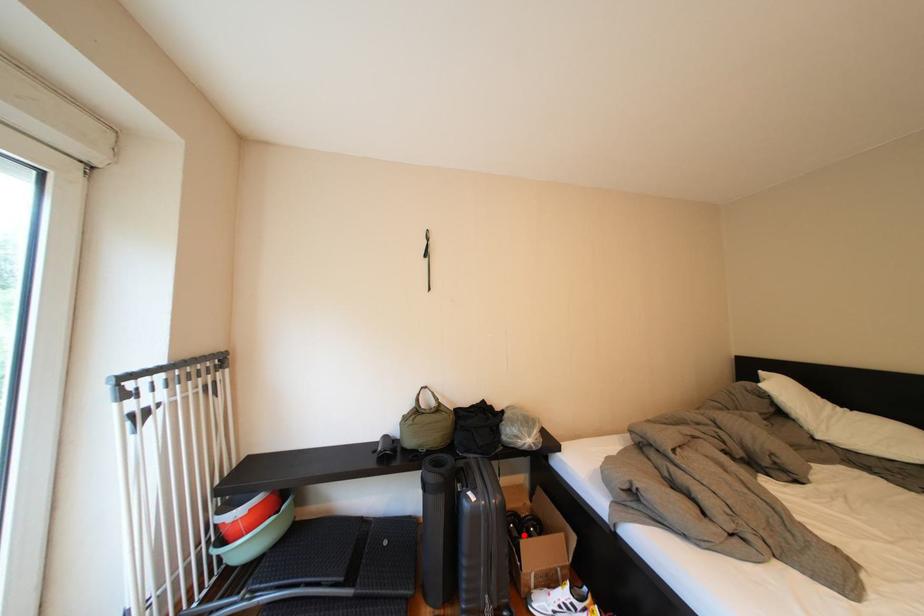
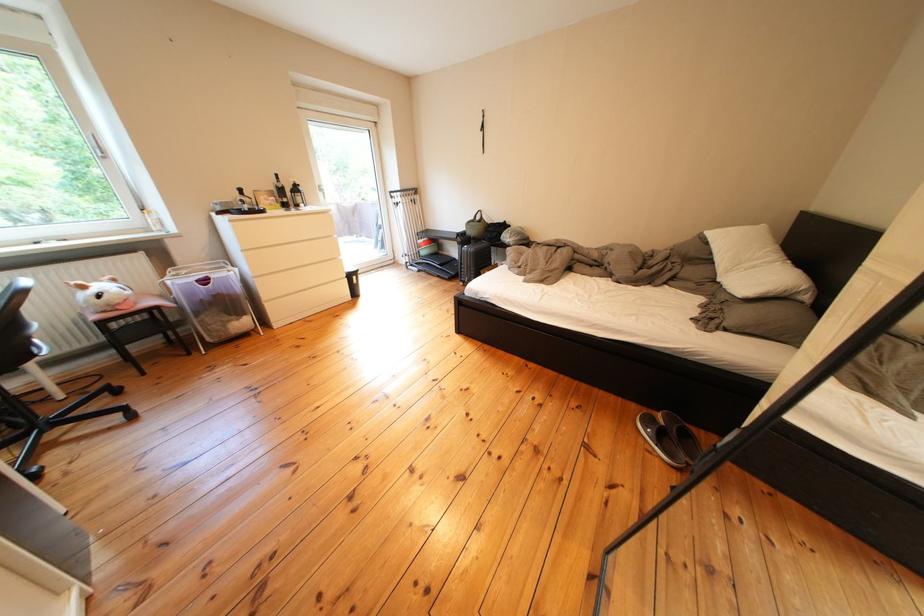
Question: I am providing you with two images of the same scene from different viewpoints. A red point is marked on the first image. Is the red point's position out of view in image 2?

Choices:
 (A) Yes
 (B) No

Answer: (A)